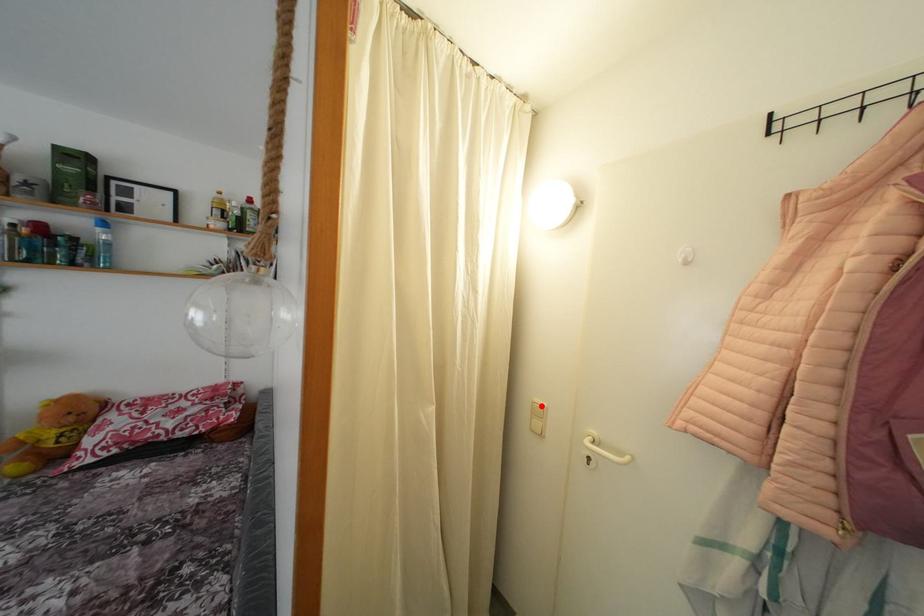
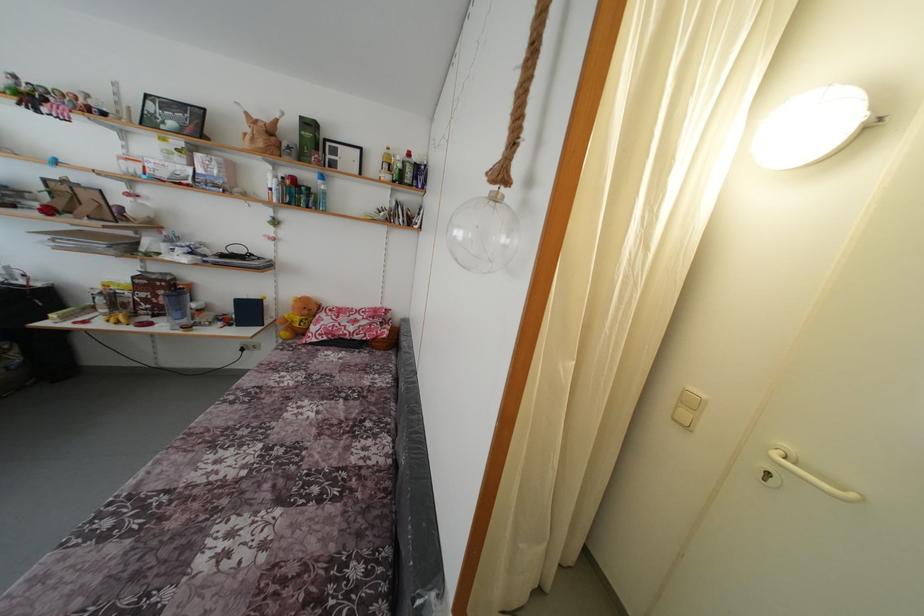
Locate, in the second image, the point that corresponds to the highlighted location in the first image.

(696, 394)